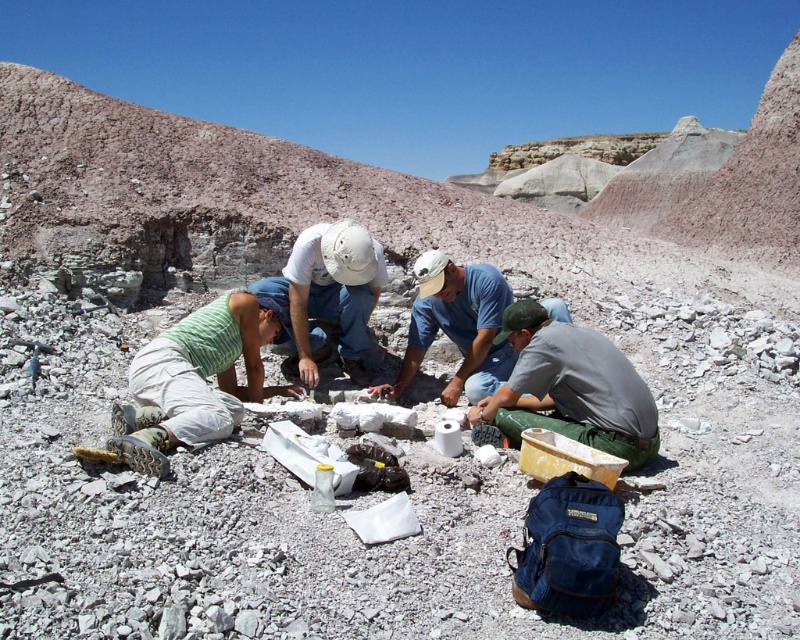
You are a photographer trying to capture a group photo of the green striped tank top at lower left and the gray cotton shirt at center. Since you want to ensure both are clearly visible, which person should you focus on more to avoid blurriness?

The gray cotton shirt at center should be focused on more because it occupies more space in the frame than the green striped tank top at lower left, ensuring clarity for the larger subject.

You are a field researcher in the desert. You need to reach the fossilized structure first before your colleague who is at point (346, 259). You are currently at point (226, 388). Which direction should you move to ensure you arrive before your colleague?

You should move towards the fossilized structure from point (226, 388) since it is in front of point (346, 259), meaning you are closer to the fossilized structure and can reach it faster.

You are a field assistant in the desert and need to identify clothing for a colleague. Which of the following has a smaller width when comparing the green striped tank top at lower left and the gray cotton shirt at center?

The green striped tank top at lower left has a smaller width than the gray cotton shirt at center.